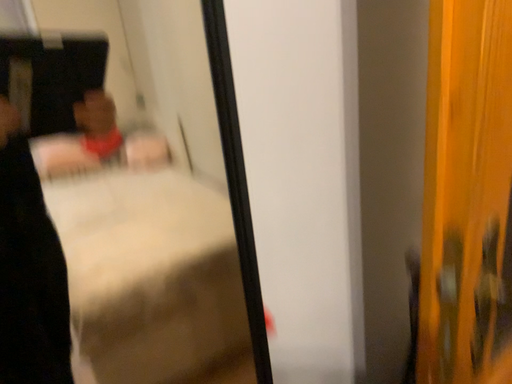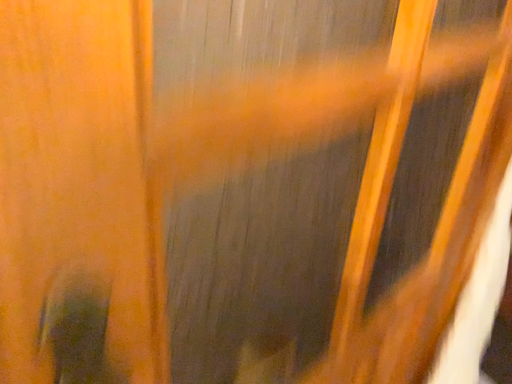
Question: How did the camera likely rotate when shooting the video?

Choices:
 (A) rotated downward
 (B) rotated upward

Answer: (A)